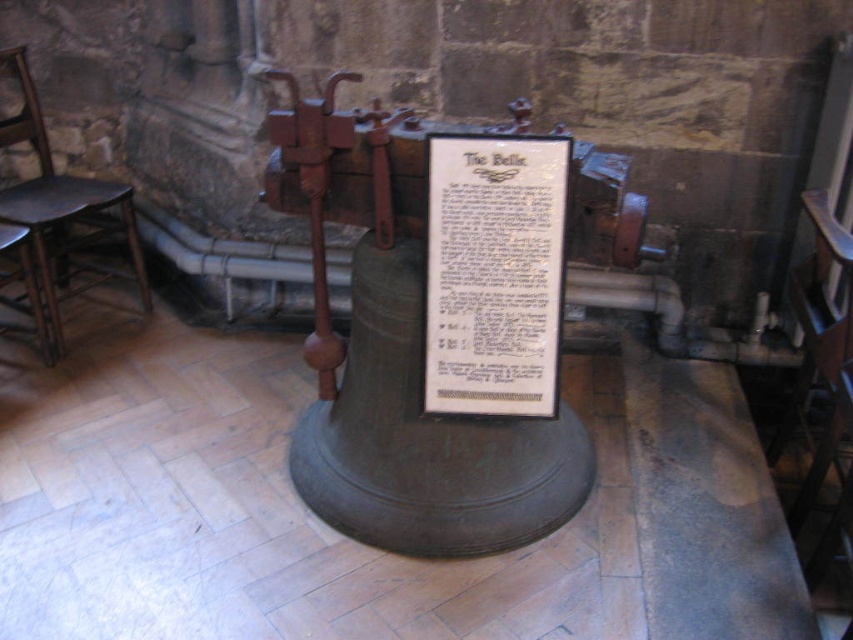
Question: Does white paper at center lie in front of dark brown wooden chair at left?

Choices:
 (A) no
 (B) yes

Answer: (B)

Question: Is white paper at center closer to camera compared to dark brown wooden chair at left?

Choices:
 (A) no
 (B) yes

Answer: (B)

Question: Among these points, which one is farthest from the camera?

Choices:
 (A) (519, 291)
 (B) (68, 218)

Answer: (B)

Question: Which point appears farthest from the camera in this image?

Choices:
 (A) (0, 220)
 (B) (469, 324)

Answer: (A)

Question: Can you confirm if white paper at center is bigger than dark brown wooden chair at left?

Choices:
 (A) yes
 (B) no

Answer: (B)